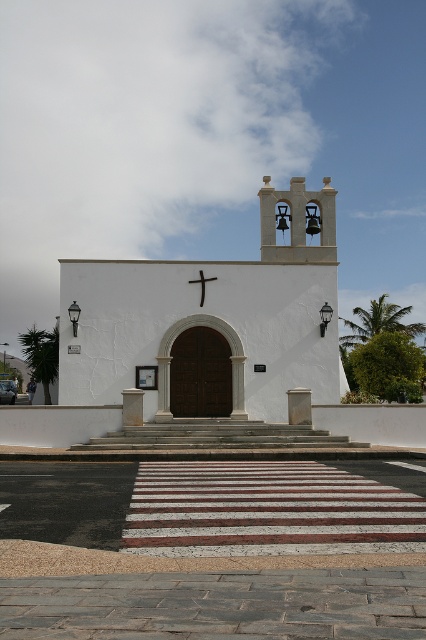
You are standing in front of the church and want to take a photo of the white stucco chapel at center. Where should you position yourself to capture it in the center of your camera frame?

You should position yourself directly in front of the white stucco chapel at center, as its 2D location is at point (210, 323), which is near the center of the frame.

You are standing in front of the church and notice two points marked on the facade. The first point is at coordinates point (287, 288) and the second is at point (204, 294). Which point is closer to your eyes?

Point (204, 294) is closer to your eyes because it is less further to the camera than point (287, 288).